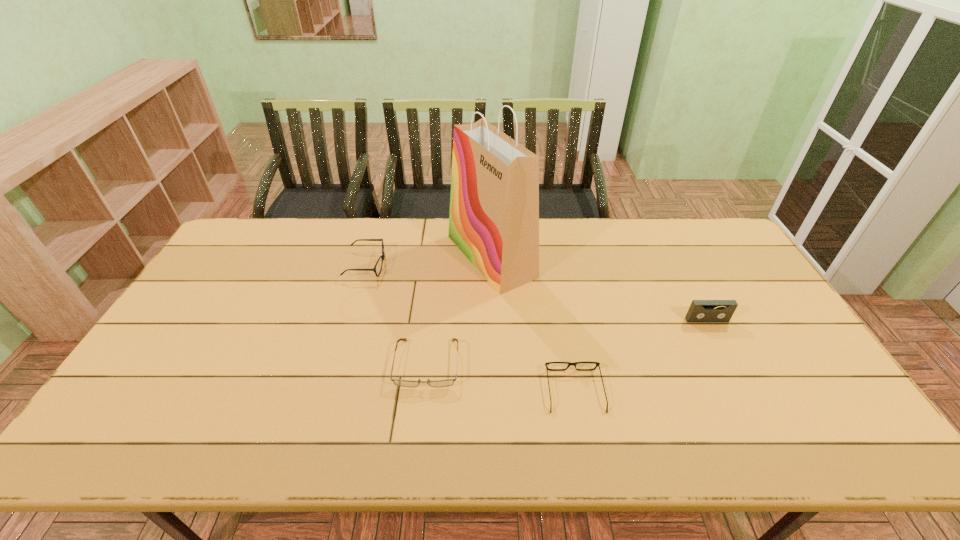
Where is `vacant area that lies between the leftmost spectacles and the tallest object`? This screenshot has height=540, width=960. vacant area that lies between the leftmost spectacles and the tallest object is located at coordinates (429, 261).

Image resolution: width=960 pixels, height=540 pixels. I want to click on vacant space that is in between the rightmost spectacles and the second spectacles from right to left, so click(x=501, y=377).

At what (x,y) coordinates should I click in order to perform the action: click on free spot between the third shortest object and the tallest object. Please return your answer as a coordinate pair (x, y). Looking at the image, I should click on (429, 261).

Where is `unoccupied area between the second spectacles from left to right and the third nearest object`? The width and height of the screenshot is (960, 540). unoccupied area between the second spectacles from left to right and the third nearest object is located at coordinates (567, 342).

At what (x,y) coordinates should I click in order to perform the action: click on free point between the second spectacles from right to left and the rightmost spectacles. Please return your answer as a coordinate pair (x, y). Image resolution: width=960 pixels, height=540 pixels. Looking at the image, I should click on (501, 377).

This screenshot has width=960, height=540. What are the coordinates of `unoccupied position between the second spectacles from right to left and the tallest object` in the screenshot? It's located at (459, 310).

Identify the location of empty location between the tallest object and the farthest spectacles. (429, 261).

Where is `unoccupied position between the leftmost spectacles and the second spectacles from right to left`? Image resolution: width=960 pixels, height=540 pixels. unoccupied position between the leftmost spectacles and the second spectacles from right to left is located at coordinates (396, 314).

At what (x,y) coordinates should I click in order to perform the action: click on vacant space that is in between the rightmost spectacles and the second spectacles from left to right. Please return your answer as a coordinate pair (x, y). The height and width of the screenshot is (540, 960). Looking at the image, I should click on (501, 377).

Identify which object is the third nearest to the second spectacles from left to right. Please provide its 2D coordinates. Your answer should be formatted as a tuple, i.e. [(x, y)], where the tuple contains the x and y coordinates of a point satisfying the conditions above.

[(382, 256)]